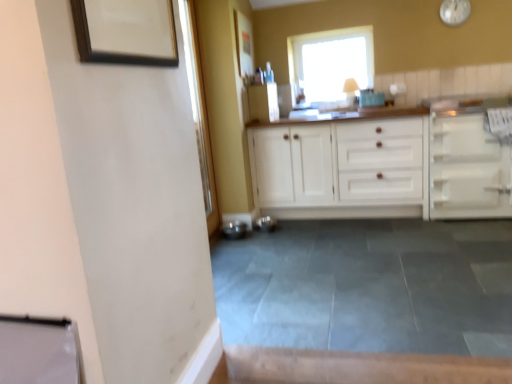
Image resolution: width=512 pixels, height=384 pixels. What are the coordinates of `transparent glass window at upper center` in the screenshot? It's located at (330, 63).

Locate an element on the screen. The height and width of the screenshot is (384, 512). white matte cabinet at right, the 1th cabinetry from the right is located at coordinates (468, 167).

What do you see at coordinates (454, 11) in the screenshot? The width and height of the screenshot is (512, 384). I see `white glossy clock at upper right` at bounding box center [454, 11].

Identify the location of matte wooden picture frame at upper center, which is the 1th picture frame from right to left. This screenshot has width=512, height=384. (244, 44).

Can you confirm if white matte cabinet at right, the 1th cabinetry from the right, is wider than matte wooden picture frame at upper center, which is the first picture frame from back to front?

Correct, the width of white matte cabinet at right, the 1th cabinetry from the right, exceeds that of matte wooden picture frame at upper center, which is the first picture frame from back to front.

Who is bigger, white matte cabinet at right, the 1th cabinetry from the right, or matte wooden picture frame at upper center, which is the first picture frame from back to front?

Bigger between the two is white matte cabinet at right, the 1th cabinetry from the right.

Are white matte cabinet at right, which is the 2th cabinetry in left-to-right order, and matte wooden picture frame at upper center, which is the first picture frame from back to front, beside each other?

No, white matte cabinet at right, which is the 2th cabinetry in left-to-right order, is not making contact with matte wooden picture frame at upper center, which is the first picture frame from back to front.

Could you tell me if white matte cabinet at right, the 1th cabinetry from the right, is facing matte wooden picture frame at upper center, which is the first picture frame from back to front?

No, white matte cabinet at right, the 1th cabinetry from the right, is not oriented towards matte wooden picture frame at upper center, which is the first picture frame from back to front.

Is white glossy clock at upper right next to matte wooden picture frame at upper center, the second picture frame from the left, and touching it?

No, white glossy clock at upper right is not next to matte wooden picture frame at upper center, the second picture frame from the left.

Consider the image. From the image's perspective, is white glossy clock at upper right positioned above or below matte wooden picture frame at upper center, placed as the second picture frame when sorted from front to back?

Based on their image positions, white glossy clock at upper right is located above matte wooden picture frame at upper center, placed as the second picture frame when sorted from front to back.

From a real-world perspective, relative to matte wooden picture frame at upper center, which is the 1th picture frame from right to left, is white glossy clock at upper right vertically above or below?

white glossy clock at upper right is situated higher than matte wooden picture frame at upper center, which is the 1th picture frame from right to left, in the real world.

Does white glossy clock at upper right have a smaller size compared to matte wooden picture frame at upper center, placed as the second picture frame when sorted from front to back?

Yes.

Does gray tile floor at center have a lesser width compared to white matte cabinet at right, which is the 2th cabinetry in left-to-right order?

No, gray tile floor at center is not thinner than white matte cabinet at right, which is the 2th cabinetry in left-to-right order.

Can you confirm if gray tile floor at center is taller than white matte cabinet at right, the 1th cabinetry from the right?

In fact, gray tile floor at center may be shorter than white matte cabinet at right, the 1th cabinetry from the right.

From the image's perspective, who appears lower, gray tile floor at center or white matte cabinet at right, the 1th cabinetry from the right?

gray tile floor at center.

In terms of width, does white wood cabinet at center, which is the first cabinetry from left to right, look wider or thinner when compared to white matte cabinet at right, the 1th cabinetry from the right?

In the image, white wood cabinet at center, which is the first cabinetry from left to right, appears to be more narrow than white matte cabinet at right, the 1th cabinetry from the right.

From a real-world perspective, who is located lower, white wood cabinet at center, which is the first cabinetry from left to right, or white matte cabinet at right, which is the 2th cabinetry in left-to-right order?

white matte cabinet at right, which is the 2th cabinetry in left-to-right order, from a real-world perspective.

Between point (408, 136) and point (438, 132), which one is positioned in front?

Positioned in front is point (438, 132).

Is white wood cabinet at center, positioned as the second cabinetry in right-to-left order, positioned before white matte cabinet at right, the 1th cabinetry from the right?

No, it is behind white matte cabinet at right, the 1th cabinetry from the right.

How many degrees apart are the facing directions of wooden picture frame at upper left, the 1th picture frame from the bottom, and matte wooden picture frame at upper center, placed as the second picture frame when sorted from front to back?

The angle between the facing direction of wooden picture frame at upper left, the 1th picture frame from the bottom, and the facing direction of matte wooden picture frame at upper center, placed as the second picture frame when sorted from front to back, is 0.852 degrees.

Considering the positions of points (111, 22) and (249, 43), is point (111, 22) closer to camera compared to point (249, 43)?

That is True.

Would you say wooden picture frame at upper left, the 2th picture frame viewed from the right, is a long distance from matte wooden picture frame at upper center, which ranks as the 2th picture frame in bottom-to-top order?

wooden picture frame at upper left, the 2th picture frame viewed from the right, is positioned a significant distance from matte wooden picture frame at upper center, which ranks as the 2th picture frame in bottom-to-top order.

Is wooden picture frame at upper left, positioned as the first picture frame in left-to-right order, facing towards matte wooden picture frame at upper center, which is the 1th picture frame from right to left?

No, wooden picture frame at upper left, positioned as the first picture frame in left-to-right order, does not turn towards matte wooden picture frame at upper center, which is the 1th picture frame from right to left.

Based on the photo, who is taller, white wood cabinet at center, positioned as the second cabinetry in right-to-left order, or gray tile floor at center?

Standing taller between the two is white wood cabinet at center, positioned as the second cabinetry in right-to-left order.

How different are the orientations of white wood cabinet at center, which is the first cabinetry from left to right, and gray tile floor at center in degrees?

The angle between the facing direction of white wood cabinet at center, which is the first cabinetry from left to right, and the facing direction of gray tile floor at center is 0.594 degrees.

Can you confirm if white wood cabinet at center, which is the first cabinetry from left to right, is smaller than gray tile floor at center?

No.

From a real-world perspective, is wooden picture frame at upper left, positioned as the first picture frame in left-to-right order, positioned above or below gray tile floor at center?

Clearly, from a real-world perspective, wooden picture frame at upper left, positioned as the first picture frame in left-to-right order, is above gray tile floor at center.

The height and width of the screenshot is (384, 512). I want to click on the 1st picture frame above the gray tile floor at center (from the image's perspective), so click(x=126, y=32).

Is wooden picture frame at upper left, the second picture frame viewed from the back, closer to camera compared to gray tile floor at center?

Yes, it is in front of gray tile floor at center.

How different are the orientations of wooden picture frame at upper left, the 1th picture frame from the bottom, and gray tile floor at center in degrees?

They differ by 89.1 degrees in their facing directions.

Find the location of a particular element. the 2nd picture frame above when counting from the white matte cabinet at right, the 1th cabinetry from the right (from the image's perspective) is located at coordinates pyautogui.click(x=244, y=44).

Starting from the white glossy clock at upper right, which picture frame is the 1st one in front? Please provide its 2D coordinates.

[(244, 44)]

Estimate the real-world distances between objects in this image. Which object is closer to wooden picture frame at upper left, the second picture frame viewed from the back, gray tile floor at center or matte wooden picture frame at upper center, placed as the second picture frame when sorted from front to back?

The object closer to wooden picture frame at upper left, the second picture frame viewed from the back, is gray tile floor at center.

When comparing their distances from white glossy clock at upper right, does white matte cabinet at right, which is the 2th cabinetry in left-to-right order, or wooden picture frame at upper left, the second picture frame viewed from the back, seem closer?

Based on the image, white matte cabinet at right, which is the 2th cabinetry in left-to-right order, appears to be nearer to white glossy clock at upper right.

Based on their spatial positions, is wooden picture frame at upper left, the 1th picture frame from the bottom, or transparent glass window at upper center closer to white glossy clock at upper right?

transparent glass window at upper center.

Estimate the real-world distances between objects in this image. Which object is closer to transparent glass window at upper center, matte wooden picture frame at upper center, arranged as the 1th picture frame when viewed from the top, or white glossy clock at upper right?

The object closer to transparent glass window at upper center is matte wooden picture frame at upper center, arranged as the 1th picture frame when viewed from the top.

Consider the image. From the image, which object appears to be nearer to white matte cabinet at right, the 1th cabinetry from the right, matte wooden picture frame at upper center, which is the first picture frame from back to front, or wooden picture frame at upper left, the 1th picture frame from the bottom?

matte wooden picture frame at upper center, which is the first picture frame from back to front.

Considering their positions, is white matte cabinet at right, the 1th cabinetry from the right, positioned further to white glossy clock at upper right than transparent glass window at upper center?

white matte cabinet at right, the 1th cabinetry from the right, is positioned further to the anchor white glossy clock at upper right.

Looking at this image, based on their spatial positions, is gray tile floor at center or white wood cabinet at center, positioned as the second cabinetry in right-to-left order, closer to wooden picture frame at upper left, the 2th picture frame viewed from the right?

gray tile floor at center.

Considering their positions, is white matte cabinet at right, the 1th cabinetry from the right, positioned further to wooden picture frame at upper left, the 1th picture frame from the bottom, than white glossy clock at upper right?

white glossy clock at upper right.

Locate an element on the screen. clock located between gray tile floor at center and transparent glass window at upper center in the depth direction is located at coordinates pos(454,11).

Locate an element on the screen. The height and width of the screenshot is (384, 512). cabinetry that lies between white glossy clock at upper right and white wood cabinet at center, which is the first cabinetry from left to right, from top to bottom is located at coordinates (468, 167).

What are the coordinates of `concrete located between wooden picture frame at upper left, placed as the first picture frame when sorted from front to back, and white wood cabinet at center, which is the first cabinetry from left to right, in the depth direction` in the screenshot? It's located at (369, 286).

This screenshot has height=384, width=512. I want to click on cabinetry positioned between gray tile floor at center and white wood cabinet at center, positioned as the second cabinetry in right-to-left order, from near to far, so [468, 167].